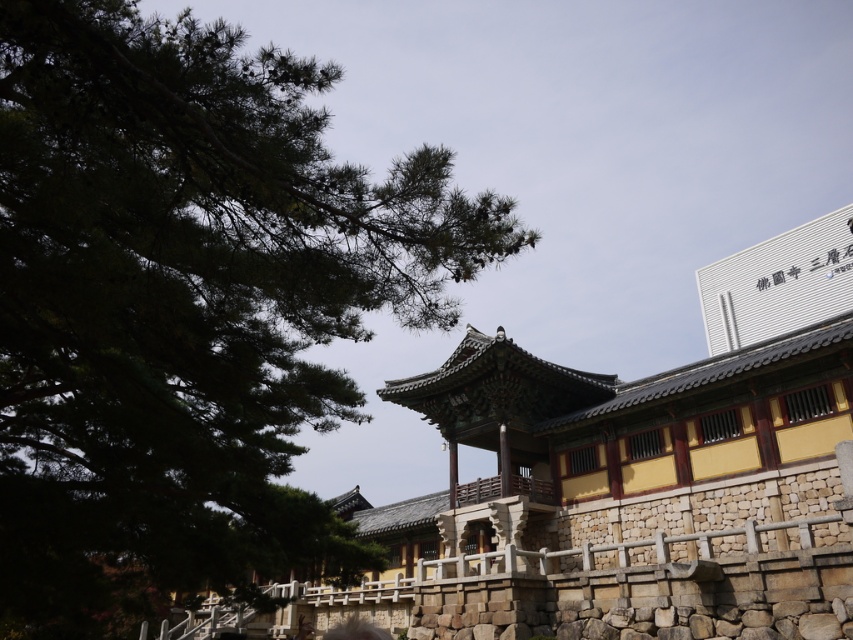
You are an architect visiting this historical site and need to take a photo of the smooth stone face at center without the green leafy tree at upper left blocking it. Where should you position yourself relative to the current viewpoint?

To avoid the green leafy tree at upper left blocking the smooth stone face at center, move to the right side of the current viewpoint. Since the tree is in front of the stone face, shifting your position to the right would allow you to see the stone face without obstruction.

You are standing in front of the traditional East Asian building and notice two points marked in the scene. Which of the two points, point (300, 273) or point (366, 627), is closer to you?

Point (300, 273) is closer to the viewer than point (366, 627).